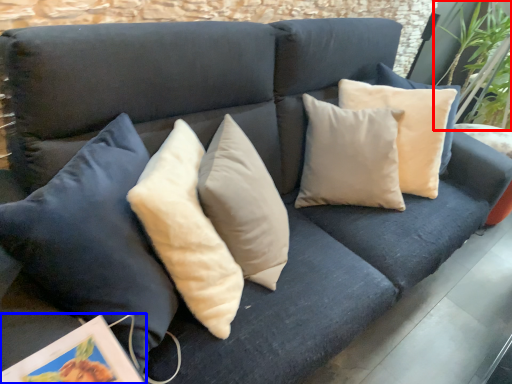
Question: Among these objects, which one is nearest to the camera, plant (highlighted by a red box) or picture frame (highlighted by a blue box)?

Choices:
 (A) plant
 (B) picture frame

Answer: (B)